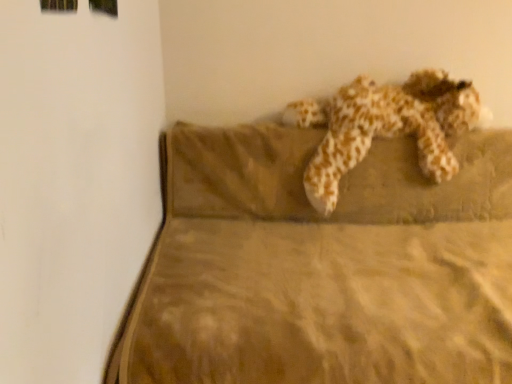
Locate an element on the screen. The height and width of the screenshot is (384, 512). brown velvety mattress at upper right is located at coordinates (325, 266).

Describe the element at coordinates (325, 266) in the screenshot. I see `brown velvety mattress at upper right` at that location.

What do you see at coordinates (385, 126) in the screenshot? The width and height of the screenshot is (512, 384). I see `fluffy beige stuffed animal at center` at bounding box center [385, 126].

The image size is (512, 384). In order to click on fluffy beige stuffed animal at center in this screenshot , I will do coord(385,126).

The height and width of the screenshot is (384, 512). Identify the location of brown velvety mattress at upper right. (325, 266).

In the image, is fluffy beige stuffed animal at center on the left side or the right side of brown velvety mattress at upper right?

From the image, it's evident that fluffy beige stuffed animal at center is to the right of brown velvety mattress at upper right.

Considering the positions of objects fluffy beige stuffed animal at center and brown velvety mattress at upper right in the image provided, who is behind, fluffy beige stuffed animal at center or brown velvety mattress at upper right?

fluffy beige stuffed animal at center is further from the camera.

Is point (346, 88) behind point (216, 195)?

No, (346, 88) is closer to viewer.

From the image's perspective, which one is positioned lower, fluffy beige stuffed animal at center or brown velvety mattress at upper right?

brown velvety mattress at upper right is shown below in the image.

From a real-world perspective, who is located higher, fluffy beige stuffed animal at center or brown velvety mattress at upper right?

fluffy beige stuffed animal at center is physically above.

Between fluffy beige stuffed animal at center and brown velvety mattress at upper right, which one has larger width?

brown velvety mattress at upper right.

Does fluffy beige stuffed animal at center have a lesser height compared to brown velvety mattress at upper right?

Indeed, fluffy beige stuffed animal at center has a lesser height compared to brown velvety mattress at upper right.

Based on their sizes in the image, would you say fluffy beige stuffed animal at center is bigger or smaller than brown velvety mattress at upper right?

Considering their sizes, fluffy beige stuffed animal at center takes up less space than brown velvety mattress at upper right.

Choose the correct answer: Is fluffy beige stuffed animal at center inside brown velvety mattress at upper right or outside it?

fluffy beige stuffed animal at center can be found inside brown velvety mattress at upper right.

Is there a large distance between fluffy beige stuffed animal at center and brown velvety mattress at upper right?

No, there isn't a large distance between fluffy beige stuffed animal at center and brown velvety mattress at upper right.

Is fluffy beige stuffed animal at center positioned with its back to brown velvety mattress at upper right?

Yes, fluffy beige stuffed animal at center is facing away from brown velvety mattress at upper right.

Consider the image. Can you tell me how much fluffy beige stuffed animal at center and brown velvety mattress at upper right differ in facing direction?

There is a 1.03-degree angle between the facing directions of fluffy beige stuffed animal at center and brown velvety mattress at upper right.

Locate an element on the screen. The height and width of the screenshot is (384, 512). mattress located in front of the fluffy beige stuffed animal at center is located at coordinates (325, 266).

Which object is positioned more to the right, brown velvety mattress at upper right or fluffy beige stuffed animal at center?

Positioned to the right is fluffy beige stuffed animal at center.

In the image, is brown velvety mattress at upper right positioned in front of or behind fluffy beige stuffed animal at center?

Visually, brown velvety mattress at upper right is located in front of fluffy beige stuffed animal at center.

Which point is more distant from viewer, (489, 134) or (430, 106)?

Positioned behind is point (489, 134).

From the image's perspective, is brown velvety mattress at upper right on fluffy beige stuffed animal at center?

No, from the image's perspective, brown velvety mattress at upper right is not over fluffy beige stuffed animal at center.

From a real-world perspective, between brown velvety mattress at upper right and fluffy beige stuffed animal at center, who is vertically lower?

brown velvety mattress at upper right is physically lower.

Considering the sizes of objects brown velvety mattress at upper right and fluffy beige stuffed animal at center in the image provided, who is wider, brown velvety mattress at upper right or fluffy beige stuffed animal at center?

With larger width is brown velvety mattress at upper right.

Considering the relative sizes of brown velvety mattress at upper right and fluffy beige stuffed animal at center in the image provided, is brown velvety mattress at upper right taller than fluffy beige stuffed animal at center?

Indeed, brown velvety mattress at upper right has a greater height compared to fluffy beige stuffed animal at center.

Does brown velvety mattress at upper right have a larger size compared to fluffy beige stuffed animal at center?

Indeed, brown velvety mattress at upper right has a larger size compared to fluffy beige stuffed animal at center.

Is fluffy beige stuffed animal at center surrounded by brown velvety mattress at upper right?

Answer: Yes, brown velvety mattress at upper right contains fluffy beige stuffed animal at center.

From the picture: Is brown velvety mattress at upper right in contact with fluffy beige stuffed animal at center?

brown velvety mattress at upper right and fluffy beige stuffed animal at center are clearly separated.

Could you tell me if brown velvety mattress at upper right is turned towards fluffy beige stuffed animal at center?

No, brown velvety mattress at upper right is not facing towards fluffy beige stuffed animal at center.

How different are the orientations of brown velvety mattress at upper right and fluffy beige stuffed animal at center in degrees?

The facing directions of brown velvety mattress at upper right and fluffy beige stuffed animal at center are 1.03 degrees apart.

How far apart are brown velvety mattress at upper right and fluffy beige stuffed animal at center?

brown velvety mattress at upper right and fluffy beige stuffed animal at center are 10.20 inches apart.

In the image, there is a brown velvety mattress at upper right. At what (x,y) coordinates should I click in order to perform the action: click on animal above it (from the image's perspective). Please return your answer as a coordinate pair (x, y). Looking at the image, I should click on (385, 126).

The height and width of the screenshot is (384, 512). I want to click on animal on the right of brown velvety mattress at upper right, so click(385, 126).

Locate an element on the screen. animal above the brown velvety mattress at upper right (from a real-world perspective) is located at coordinates (385, 126).